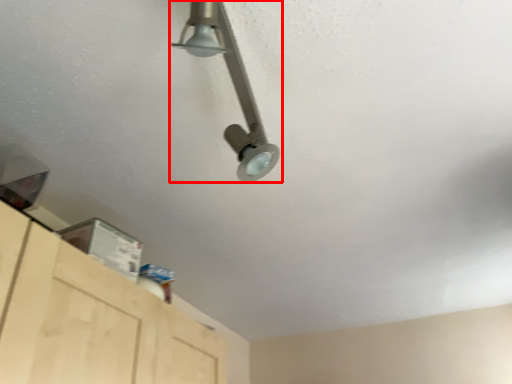
Question: From the image's perspective, where is lamp (annotated by the red box) located relative to cabinetry?

Choices:
 (A) below
 (B) above

Answer: (B)